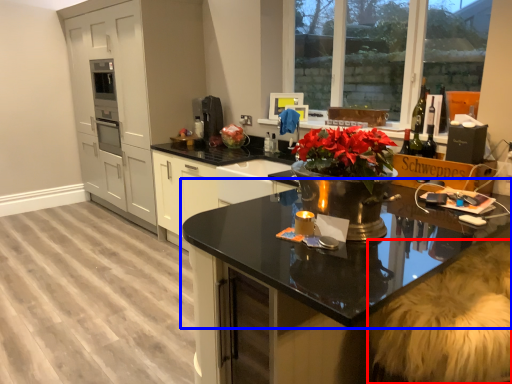
Question: Which of the following is the closest to the observer, swivel chair (highlighted by a red box) or countertop (highlighted by a blue box)?

Choices:
 (A) swivel chair
 (B) countertop

Answer: (B)